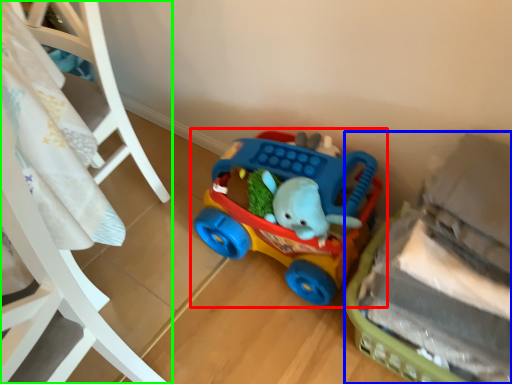
Question: Which object is the closest to the toy (highlighted by a red box)? Choose among these: toy (highlighted by a blue box) or furniture (highlighted by a green box).

Choices:
 (A) toy
 (B) furniture

Answer: (A)